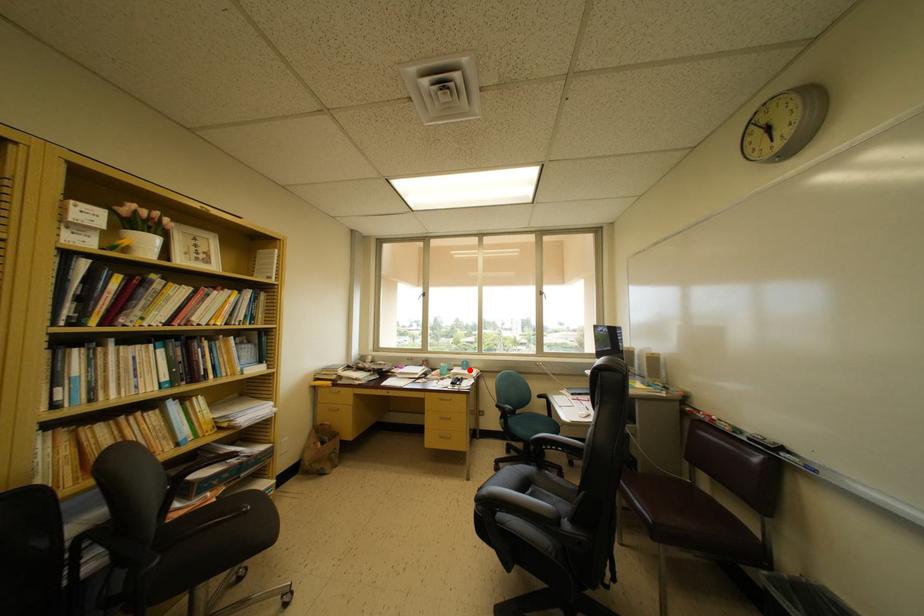
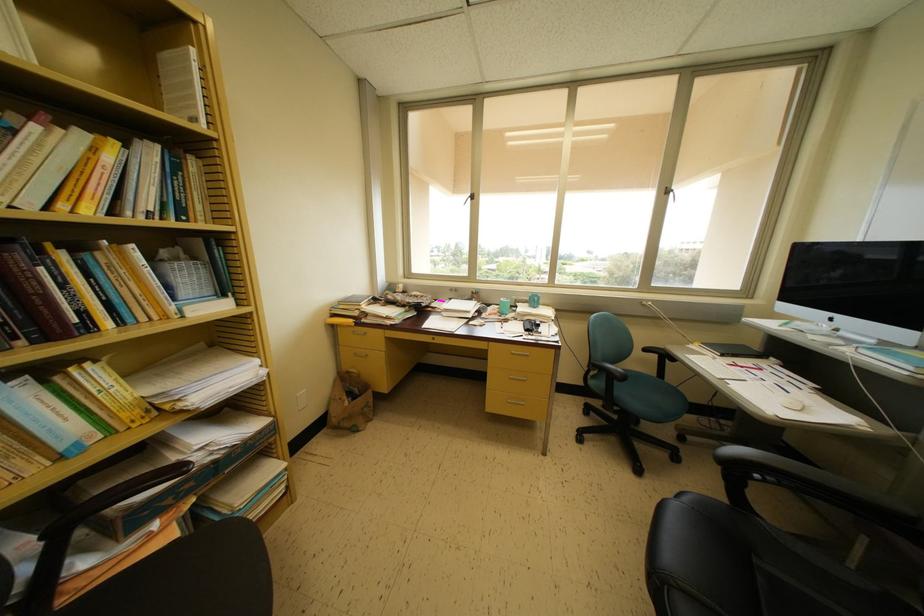
Question: A red point is marked in image1. In image2, is the corresponding 3D point closer to the camera or farther? Reply with the corresponding letter.

Choices:
 (A) The corresponding 3D point is closer.
 (B) The corresponding 3D point is farther.

Answer: (A)